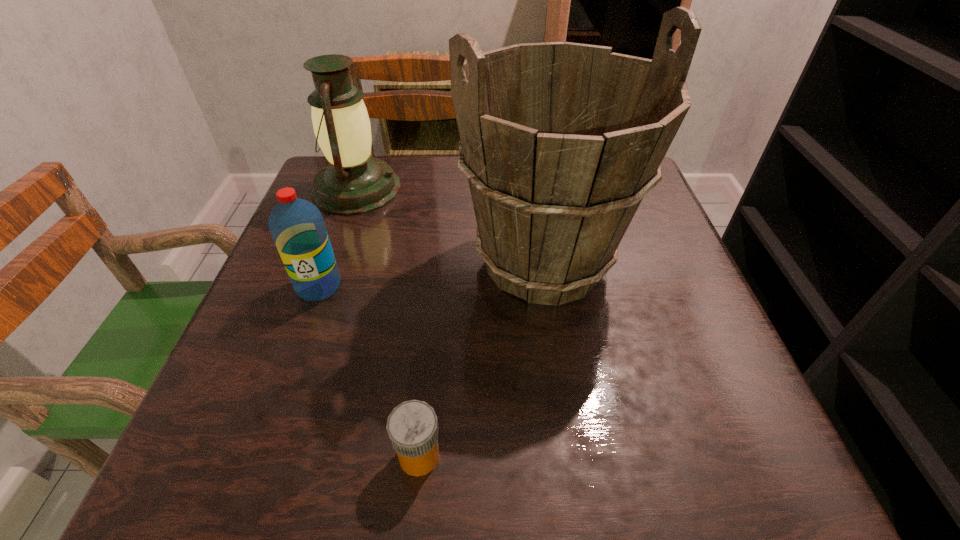
The height and width of the screenshot is (540, 960). In the image, there is a desktop. Identify the location of vacant space at the near left corner. (205, 454).

The height and width of the screenshot is (540, 960). I want to click on free space between the shortest object and the water bottle, so click(369, 371).

Locate an element on the screen. vacant space that is in between the second tallest object and the water bottle is located at coordinates (338, 238).

This screenshot has height=540, width=960. In order to click on vacant area between the rightmost object and the water bottle in this screenshot , I will do `click(432, 274)`.

This screenshot has height=540, width=960. Find the location of `empty space between the water bottle and the rightmost object`. empty space between the water bottle and the rightmost object is located at coordinates (432, 274).

Where is `free spot between the shortest object and the lantern`? The width and height of the screenshot is (960, 540). free spot between the shortest object and the lantern is located at coordinates (388, 322).

The width and height of the screenshot is (960, 540). I want to click on vacant area that lies between the lantern and the medicine, so click(x=388, y=322).

Locate an element on the screen. This screenshot has width=960, height=540. free area in between the rightmost object and the medicine is located at coordinates (482, 359).

Find the location of a particular element. The image size is (960, 540). vacant area between the second shortest object and the shortest object is located at coordinates (369, 371).

Identify the location of free space between the second tallest object and the tallest object. The image size is (960, 540). (450, 226).